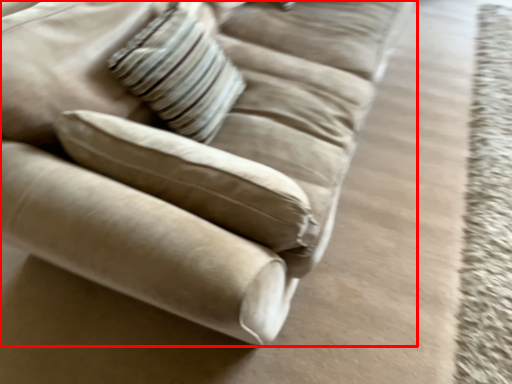
Question: From the image's perspective, considering the relative positions of studio couch (annotated by the red box) and pillow in the image provided, where is studio couch (annotated by the red box) located with respect to the staircase?

Choices:
 (A) below
 (B) above

Answer: (B)